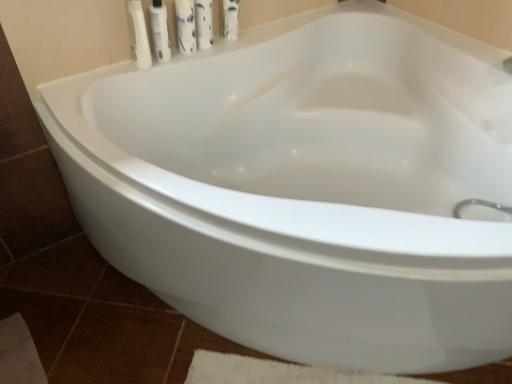
Question: From the image's perspective, is white glossy bottle at upper left, which is the 2th cleaning product from right to left, positioned above or below white plastic tube at upper left, arranged as the 1th toiletry when viewed from the left?

Choices:
 (A) above
 (B) below

Answer: (A)

Question: Looking at their shapes, would you say white glossy bottle at upper left, the first cleaning product when ordered from left to right, is wider or thinner than white plastic tube at upper left, acting as the second toiletry starting from the right?

Choices:
 (A) thin
 (B) wide

Answer: (A)

Question: Which is farther from the white glossy bottle at upper left, the 2th toiletry viewed from the left?

Choices:
 (A) white glossy mouthwash at upper center
 (B) white glossy bottle at upper center, the 2th cleaning product when ordered from left to right
 (C) white glossy bottle at upper left, the first cleaning product when ordered from left to right
 (D) white plastic tube at upper left, acting as the second toiletry starting from the right

Answer: (A)

Question: Estimate the real-world distances between objects in this image. Which object is closer to the white glossy mouthwash at upper center?

Choices:
 (A) white plastic tube at upper left, acting as the second toiletry starting from the right
 (B) white glossy bottle at upper center, which is counted as the 1th cleaning product, starting from the right
 (C) white glossy bottle at upper left, which is the 2th cleaning product from right to left
 (D) white glossy bottle at upper left, the 1th toiletry viewed from the right

Answer: (B)